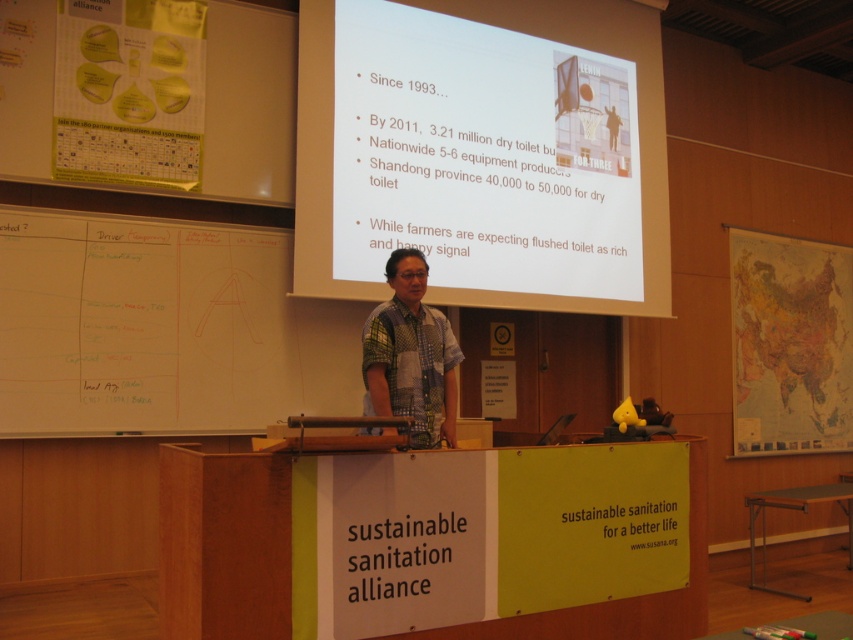
Does whiteboard at left have a larger size compared to printed cotton shirt at center?

Correct, whiteboard at left is larger in size than printed cotton shirt at center.

Can you confirm if whiteboard at left is positioned above printed cotton shirt at center?

Yes, whiteboard at left is above printed cotton shirt at center.

Is point (178, 371) farther from camera compared to point (396, 326)?

Yes, point (178, 371) is farther from viewer.

Identify the location of whiteboard at left. The width and height of the screenshot is (853, 640). tap(142, 324).

Which is below, white matte projector screen at upper center or wooden podium at center?

wooden podium at center

Is point (476, 26) farther from camera compared to point (233, 616)?

Yes, it is.

Between point (352, 128) and point (236, 497), which one is positioned in front?

Positioned in front is point (236, 497).

Identify the location of white matte projector screen at upper center. (485, 150).

Which of these two, white matte projector screen at upper center or whiteboard at left, stands shorter?

Standing shorter between the two is whiteboard at left.

Does point (633, 145) come in front of point (250, 320)?

No, (633, 145) is further to viewer.

The image size is (853, 640). In order to click on white matte projector screen at upper center in this screenshot , I will do `click(485, 150)`.